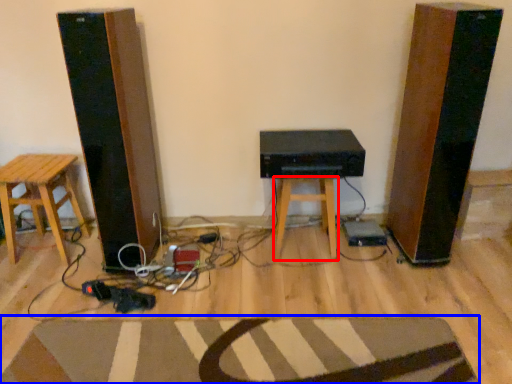
Question: Which object is closer to the camera taking this photo, stool (highlighted by a red box) or doormat (highlighted by a blue box)?

Choices:
 (A) stool
 (B) doormat

Answer: (B)